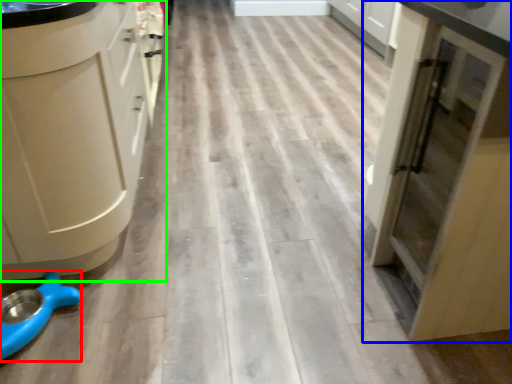
Question: Estimate the real-world distances between objects in this image. Which object is farther from appliance (highlighted by a red box), cupboard (highlighted by a blue box) or cabinetry (highlighted by a green box)?

Choices:
 (A) cupboard
 (B) cabinetry

Answer: (A)